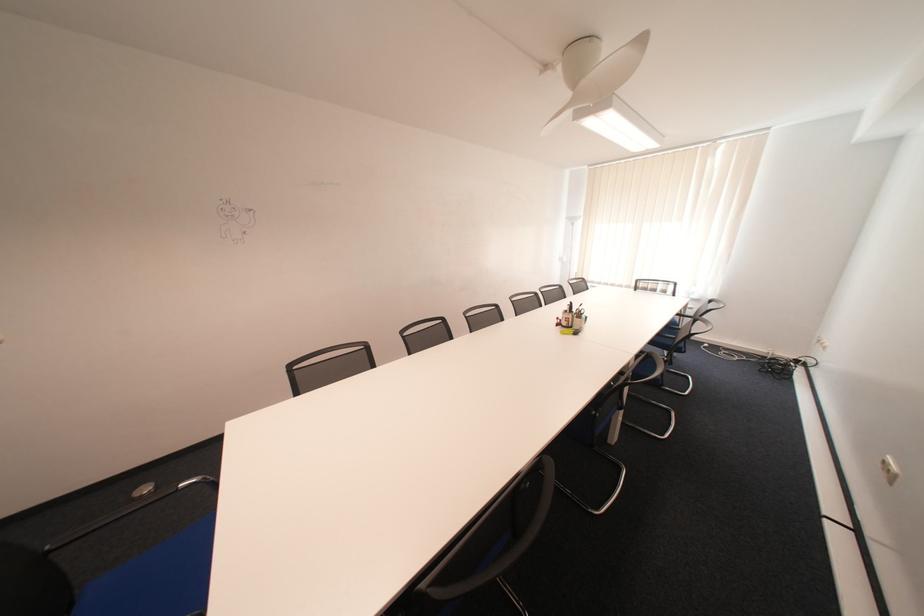
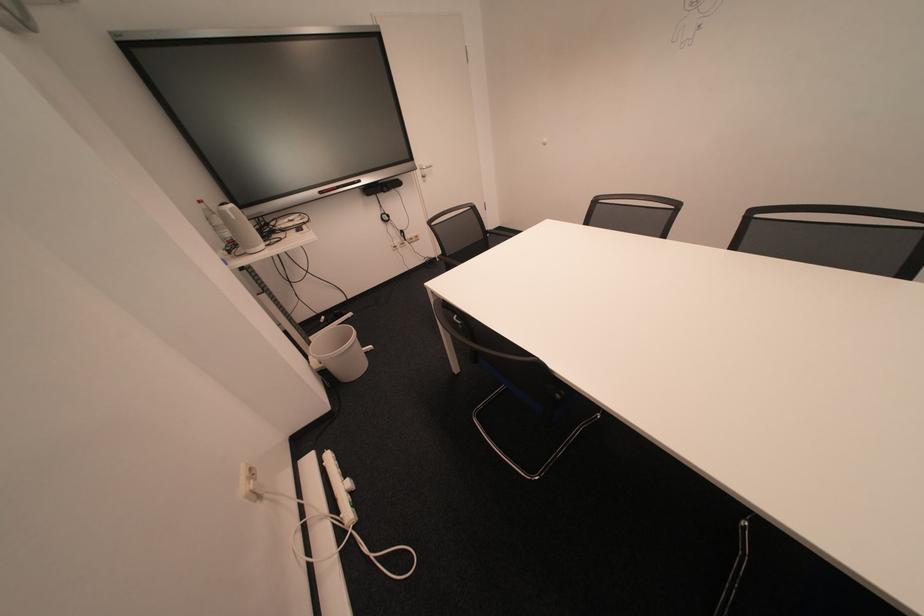
The first image is from the beginning of the video and the second image is from the end. How did the camera likely rotate when shooting the video?

The rotation direction of the camera is left-down.